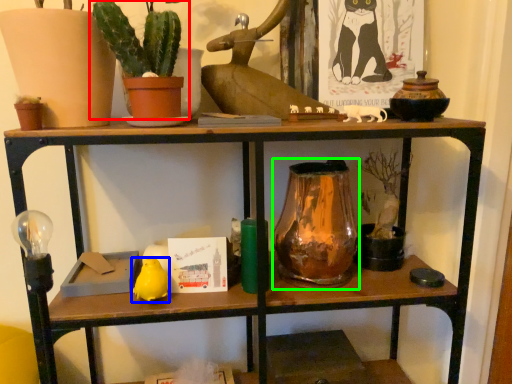
Question: Estimate the real-world distances between objects in this image. Which object is closer to houseplant (highlighted by a red box), animal (highlighted by a blue box) or glass vase (highlighted by a green box)?

Choices:
 (A) animal
 (B) glass vase

Answer: (B)